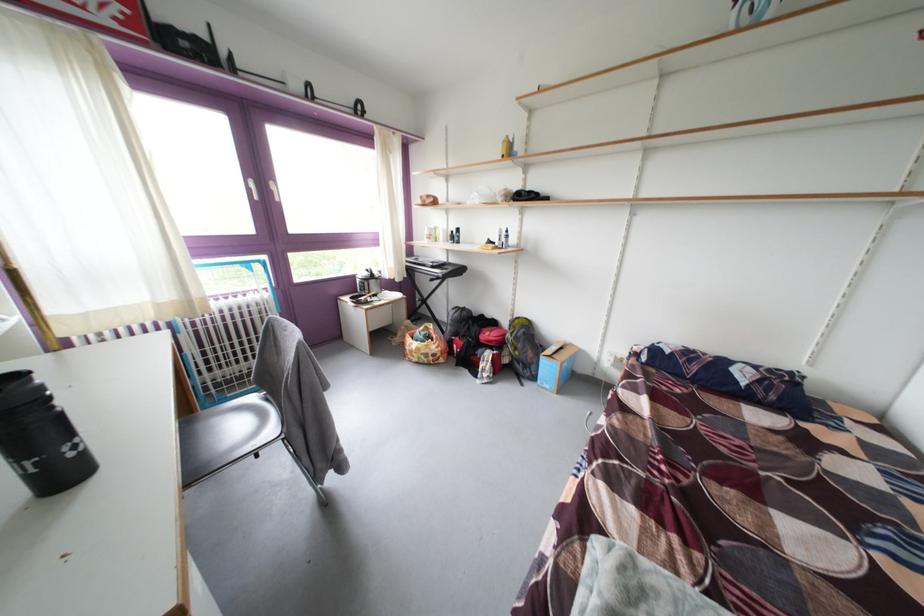
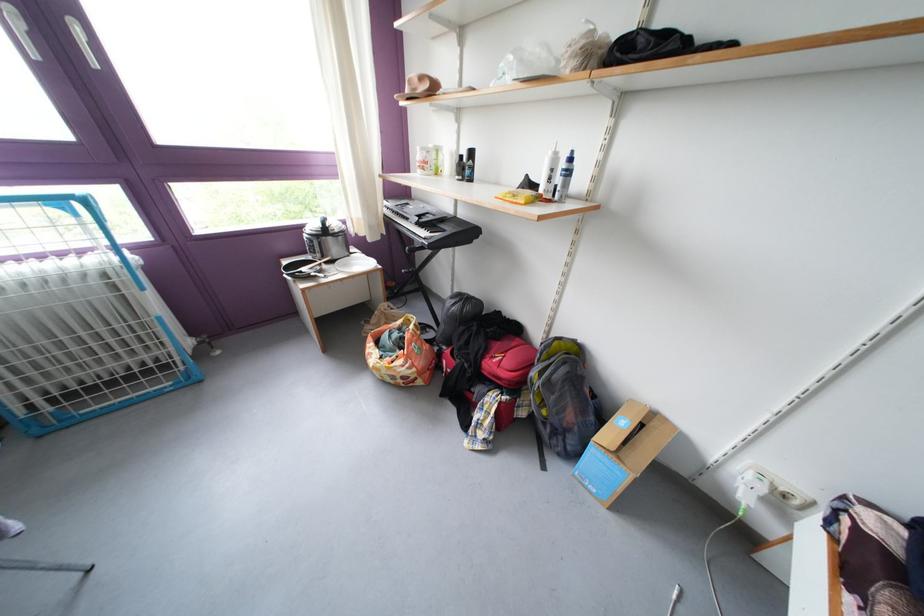
Where in the second image is the point corresponding to point (385, 301) from the first image?

(344, 267)